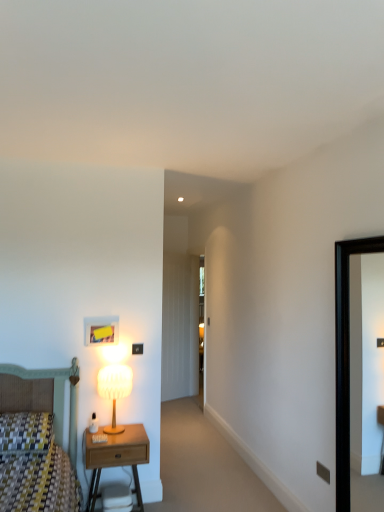
Locate an element on the screen. The image size is (384, 512). free area below matte white lamp at left (from a real-world perspective) is located at coordinates (125, 426).